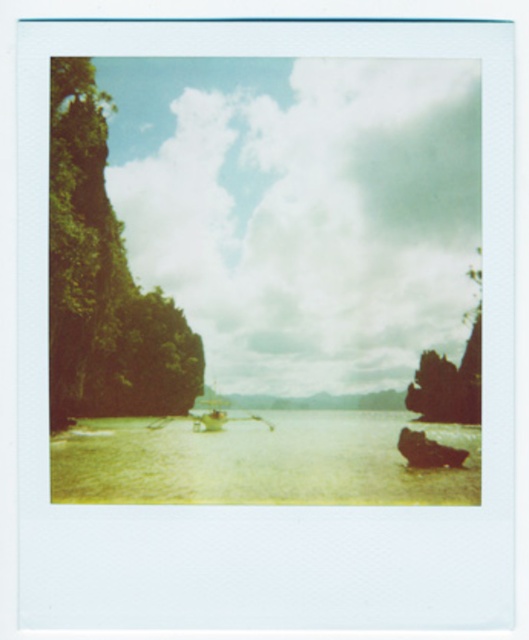
Does clear water at center appear on the right side of dark brown wooden boat at lower right?

No, clear water at center is not to the right of dark brown wooden boat at lower right.

Between clear water at center and dark brown wooden boat at lower right, which one appears on the left side from the viewer's perspective?

Positioned to the left is clear water at center.

What do you see at coordinates (259, 461) in the screenshot?
I see `clear water at center` at bounding box center [259, 461].

The image size is (529, 640). In order to click on clear water at center in this screenshot , I will do `click(259, 461)`.

Based on the photo, does clear water at center have a larger size compared to green matte boat at center?

Yes.

Does clear water at center have a lesser width compared to green matte boat at center?

In fact, clear water at center might be wider than green matte boat at center.

Is point (118, 488) behind point (211, 413)?

No.

Find the location of a particular element. The height and width of the screenshot is (640, 529). clear water at center is located at coordinates (259, 461).

Is clear water at center to the right of green leafy rock at left from the viewer's perspective?

Indeed, clear water at center is positioned on the right side of green leafy rock at left.

Looking at this image, does clear water at center have a lesser height compared to green leafy rock at left?

Indeed, clear water at center has a lesser height compared to green leafy rock at left.

Is point (321, 424) behind point (168, 387)?

Yes, it is.

Where is `clear water at center`? This screenshot has width=529, height=640. clear water at center is located at coordinates (259, 461).